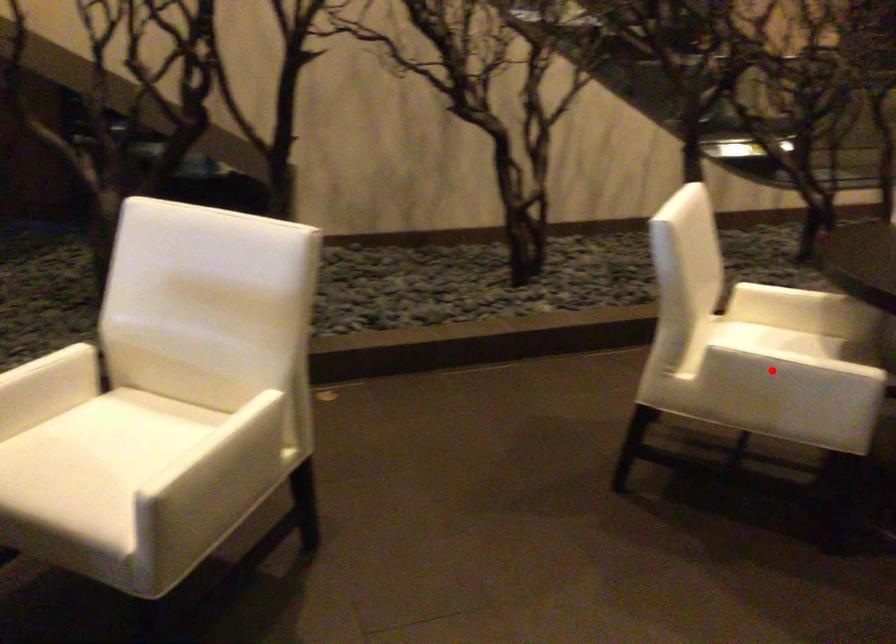
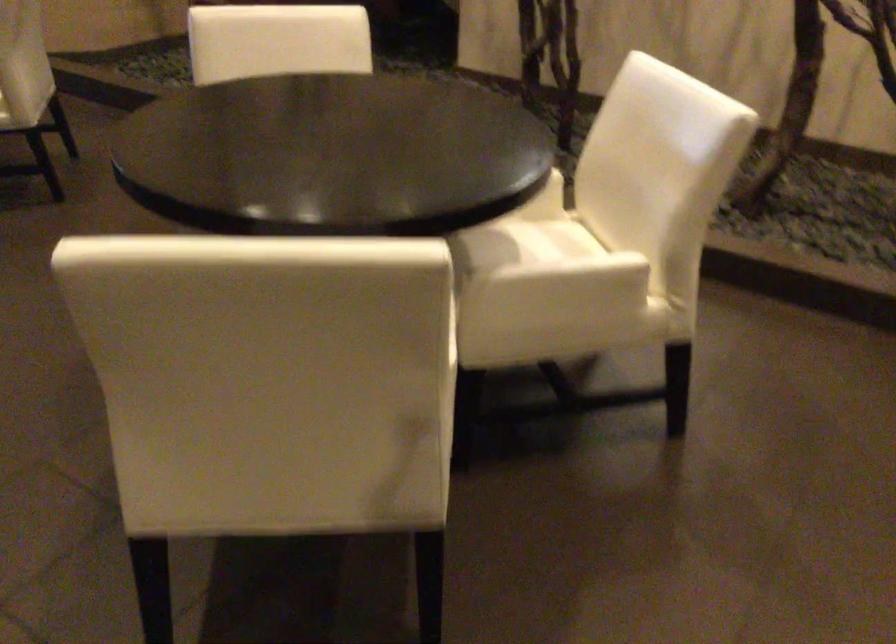
Question: I am providing you with two images of the same scene from different viewpoints. A red point is marked on the first image. Can you still see the location of the red point in image 2?

Choices:
 (A) Yes
 (B) No

Answer: (B)